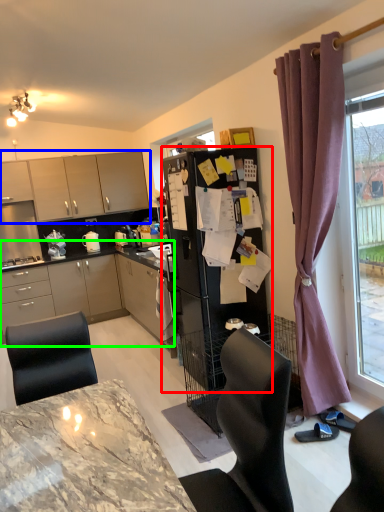
Question: Which object is positioned closest to refrigerator (highlighted by a red box)? Select from cabinetry (highlighted by a blue box) and cabinetry (highlighted by a green box).

Choices:
 (A) cabinetry
 (B) cabinetry

Answer: (B)